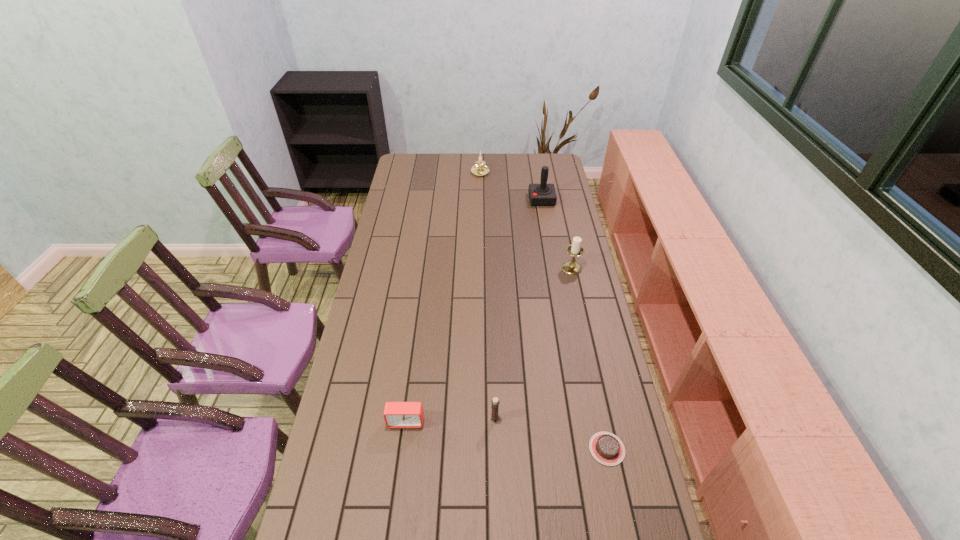
I want to click on chocolate cake located at the right edge, so click(606, 448).

The height and width of the screenshot is (540, 960). In order to click on vacant space at the left edge in this screenshot , I will do `click(356, 415)`.

In the image, there is a desktop. Where is `free region at the right edge`? The width and height of the screenshot is (960, 540). free region at the right edge is located at coordinates (561, 320).

You are a GUI agent. You are given a task and a screenshot of the screen. Output one action in this format:
    pyautogui.click(x=<x>, y=<y>)
    Task: Click on the free space at the far right corner
    Image resolution: width=960 pixels, height=540 pixels.
    Given the screenshot: What is the action you would take?
    pyautogui.click(x=562, y=163)

Find the location of a particular element. The image size is (960, 540). unoccupied area between the tallest candle holder and the nearest candle holder is located at coordinates (533, 343).

I want to click on unoccupied area between the farthest object and the alarm clock, so click(x=444, y=297).

The width and height of the screenshot is (960, 540). In order to click on unoccupied area between the second farthest object and the third farthest object in this screenshot , I will do `click(557, 234)`.

Identify the location of free point between the joystick and the nearest candle holder. Image resolution: width=960 pixels, height=540 pixels. click(x=518, y=309).

Find the location of a particular element. The height and width of the screenshot is (540, 960). free space between the rightmost candle holder and the farthest object is located at coordinates (526, 220).

In order to click on free area in between the rightmost candle holder and the second farthest object in this screenshot , I will do `click(557, 234)`.